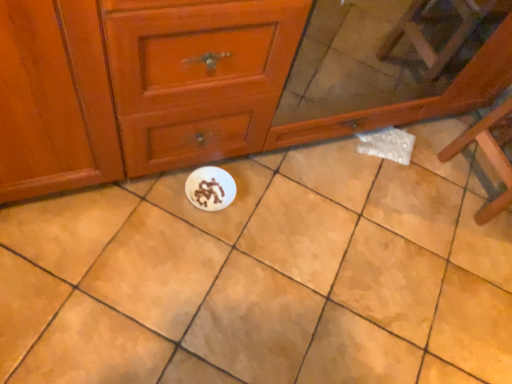
Question: Is white glossy plate at center completely or partially inside matte wood chest of drawers at center?

Choices:
 (A) yes
 (B) no

Answer: (B)

Question: From the image's perspective, is matte wood chest of drawers at center under white glossy plate at center?

Choices:
 (A) yes
 (B) no

Answer: (B)

Question: Is matte wood chest of drawers at center bigger than white glossy plate at center?

Choices:
 (A) no
 (B) yes

Answer: (B)

Question: Does matte wood chest of drawers at center have a greater height compared to white glossy plate at center?

Choices:
 (A) no
 (B) yes

Answer: (B)

Question: Is matte wood chest of drawers at center completely or partially outside of white glossy plate at center?

Choices:
 (A) yes
 (B) no

Answer: (A)

Question: Is matte wood chest of drawers at center wider than white glossy plate at center?

Choices:
 (A) yes
 (B) no

Answer: (B)

Question: Is wooden chair at right bigger than matte wood chest of drawers at center?

Choices:
 (A) no
 (B) yes

Answer: (A)

Question: Considering the relative positions of wooden chair at right and matte wood chest of drawers at center in the image provided, is wooden chair at right to the left of matte wood chest of drawers at center from the viewer's perspective?

Choices:
 (A) no
 (B) yes

Answer: (A)

Question: From a real-world perspective, is wooden chair at right beneath matte wood chest of drawers at center?

Choices:
 (A) yes
 (B) no

Answer: (A)

Question: From a real-world perspective, is wooden chair at right physically above matte wood chest of drawers at center?

Choices:
 (A) yes
 (B) no

Answer: (B)

Question: From the image's perspective, is wooden chair at right above matte wood chest of drawers at center?

Choices:
 (A) no
 (B) yes

Answer: (A)

Question: Does wooden chair at right come behind matte wood chest of drawers at center?

Choices:
 (A) yes
 (B) no

Answer: (A)

Question: From the image's perspective, does white matte paper plate at center appear higher than white glossy plate at center?

Choices:
 (A) no
 (B) yes

Answer: (B)